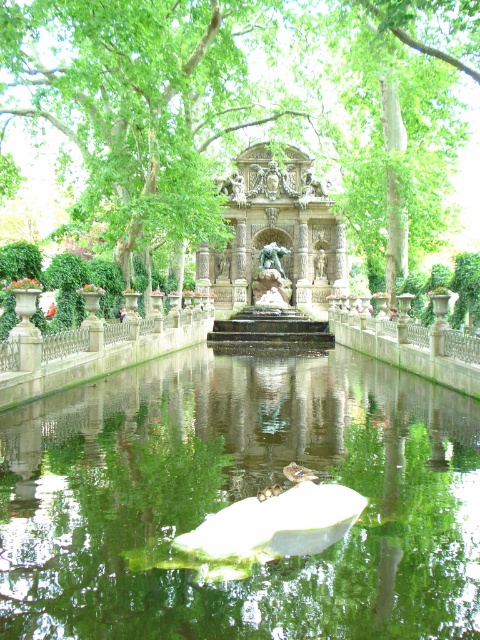
You are a visitor in the garden and want to take a photo of both the bronze sculpture at center and the green patinated bronze statue at center. Since you have a wide angle lens, you can capture both in one shot. However, you notice that one of them is positioned higher than the other. Which one is higher?

The bronze sculpture at center is higher than the green patinated bronze statue at center because the description states that it is above the other.